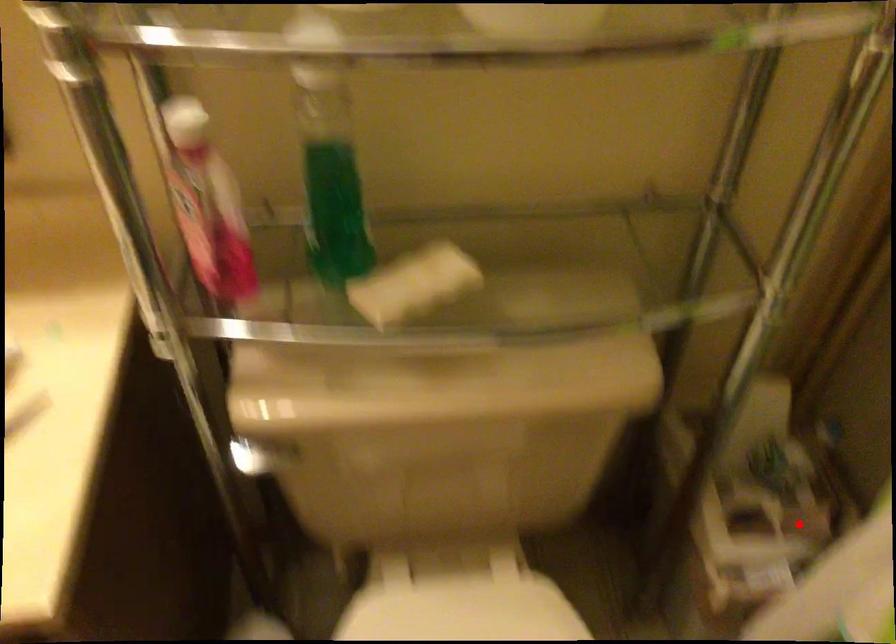
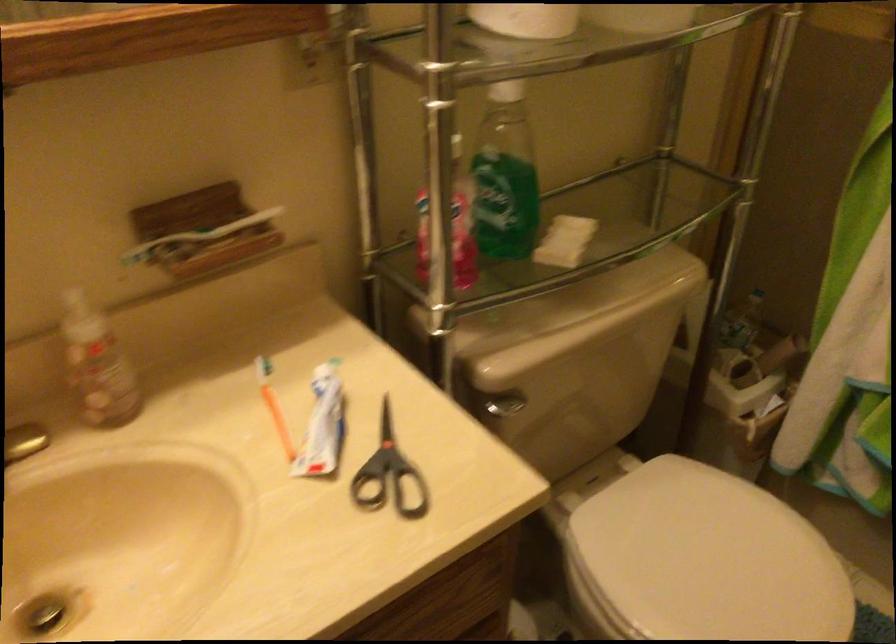
Find the pixel in the second image that matches the highlighted location in the first image.

(764, 361)